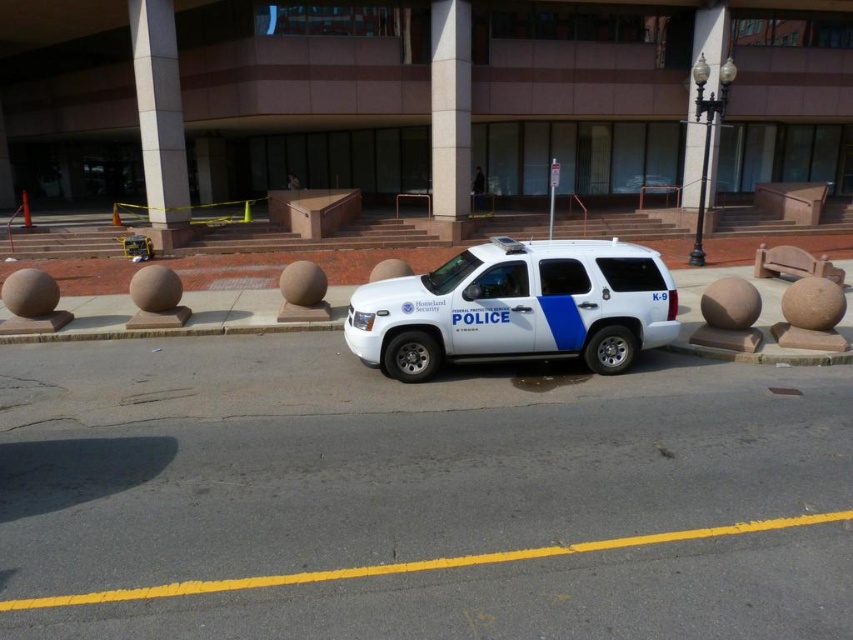
In the scene shown: You are standing in front of the white police vehicle and want to walk to the entrance of the building. Which point, point (589, 342) or point (669, 188), is closer to you as you approach the entrance?

Point (589, 342) is closer to the viewer than point (669, 188), so it is the closer point as you approach the entrance.